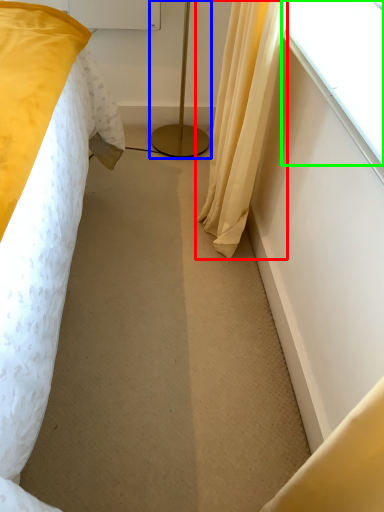
Question: Which is farther away from curtain (highlighted by a red box)? lamp (highlighted by a blue box) or window (highlighted by a green box)?

Choices:
 (A) lamp
 (B) window

Answer: (A)